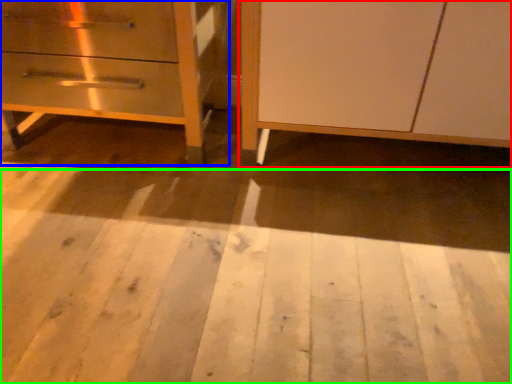
Question: Which object is positioned closest to furniture (highlighted by a red box)? Select from chest of drawers (highlighted by a blue box) and plywood (highlighted by a green box).

Choices:
 (A) chest of drawers
 (B) plywood

Answer: (B)